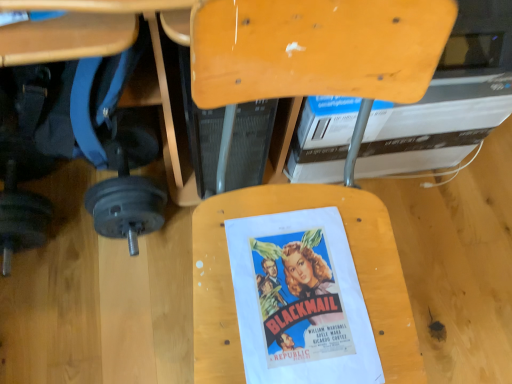
Question: Can you confirm if wooden chair at center is shorter than brushed metal dumbbell at lower left?

Choices:
 (A) no
 (B) yes

Answer: (A)

Question: Does wooden chair at center appear on the left side of brushed metal dumbbell at lower left?

Choices:
 (A) no
 (B) yes

Answer: (A)

Question: Is wooden chair at center next to brushed metal dumbbell at lower left and touching it?

Choices:
 (A) no
 (B) yes

Answer: (A)

Question: Can you confirm if wooden chair at center is bigger than brushed metal dumbbell at lower left?

Choices:
 (A) yes
 (B) no

Answer: (A)

Question: Considering the relative sizes of wooden chair at center and brushed metal dumbbell at lower left in the image provided, is wooden chair at center thinner than brushed metal dumbbell at lower left?

Choices:
 (A) yes
 (B) no

Answer: (B)

Question: Does wooden chair at center have a smaller size compared to brushed metal dumbbell at lower left?

Choices:
 (A) yes
 (B) no

Answer: (B)

Question: Is brushed metal dumbbell at lower left thinner than white cardboard book at upper center?

Choices:
 (A) no
 (B) yes

Answer: (B)

Question: Is brushed metal dumbbell at lower left in contact with white cardboard book at upper center?

Choices:
 (A) yes
 (B) no

Answer: (B)

Question: From a real-world perspective, is brushed metal dumbbell at lower left on top of white cardboard book at upper center?

Choices:
 (A) yes
 (B) no

Answer: (A)

Question: Could you tell me if brushed metal dumbbell at lower left is facing white cardboard book at upper center?

Choices:
 (A) yes
 (B) no

Answer: (B)

Question: Is brushed metal dumbbell at lower left in front of white cardboard book at upper center?

Choices:
 (A) yes
 (B) no

Answer: (A)

Question: Does brushed metal dumbbell at lower left have a greater height compared to white cardboard book at upper center?

Choices:
 (A) no
 (B) yes

Answer: (A)

Question: Can you confirm if matte paper movie poster at center is wider than white cardboard book at upper center?

Choices:
 (A) yes
 (B) no

Answer: (B)